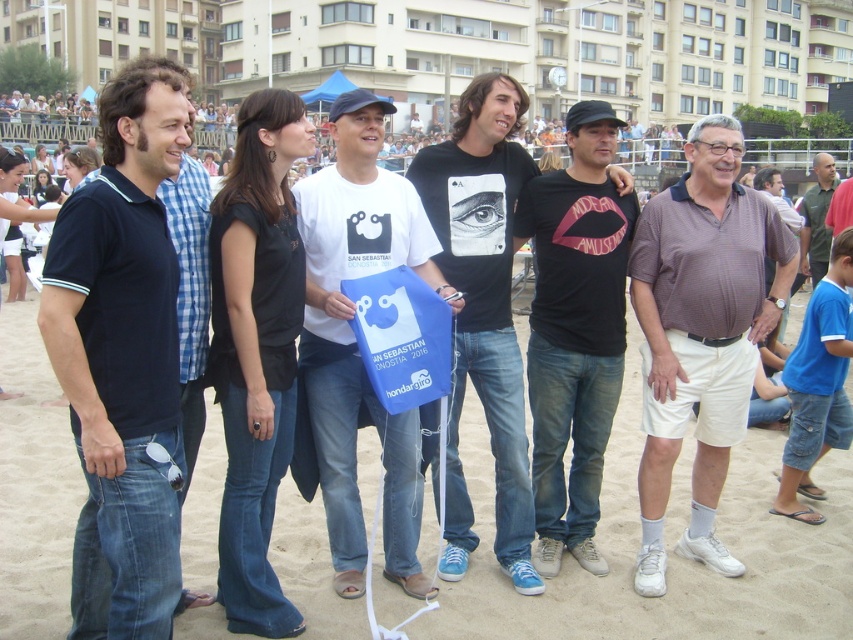
Question: Which object is farther from the camera taking this photo?

Choices:
 (A) white cotton t-shirt at center
 (B) brown cotton shirt at center
 (C) green fabric shirt at center
 (D) black cotton t-shirt at center

Answer: (C)

Question: Does black matte t-shirt at center lie behind green fabric shirt at center?

Choices:
 (A) yes
 (B) no

Answer: (B)

Question: Based on their relative distances, which object is farther from the dark blue polo shirt at left?

Choices:
 (A) black cotton t-shirt at center
 (B) black matte t-shirt at center
 (C) brown cotton polo shirt at right
 (D) sandy beach at center

Answer: (C)

Question: Does white cotton t-shirt at center appear under brown cotton shirt at center?

Choices:
 (A) no
 (B) yes

Answer: (B)

Question: Is black cotton t-shirt at center to the left of green fabric shirt at center from the viewer's perspective?

Choices:
 (A) no
 (B) yes

Answer: (B)

Question: Which point is closer to the camera taking this photo?

Choices:
 (A) (109, 99)
 (B) (491, 252)

Answer: (A)